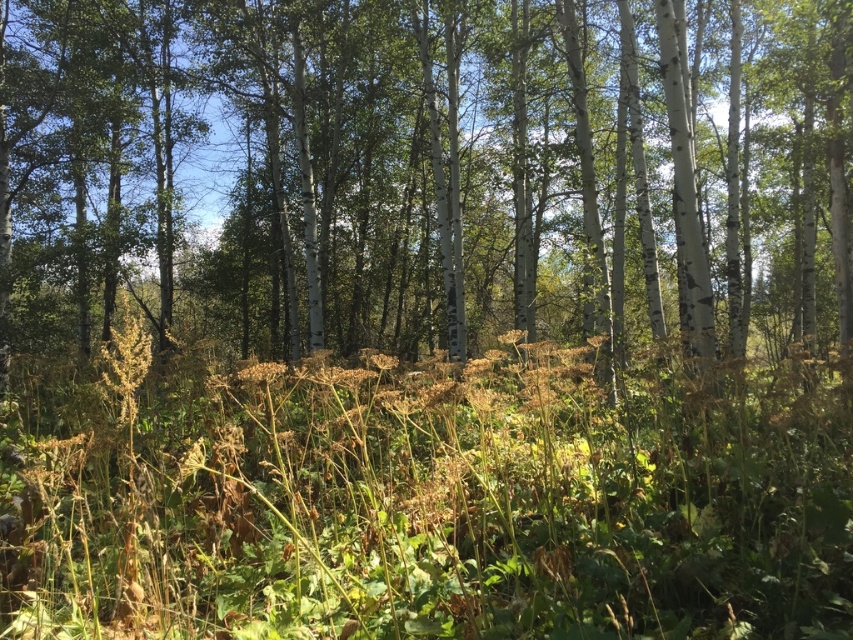
Question: In this image, where is white smooth tree at center located relative to brown dry grass at center?

Choices:
 (A) right
 (B) left

Answer: (A)

Question: Is the position of white smooth tree at center more distant than that of brown dry grass at center?

Choices:
 (A) no
 (B) yes

Answer: (B)

Question: From the image, what is the correct spatial relationship of white smooth tree at center in relation to brown dry grass at center?

Choices:
 (A) right
 (B) left

Answer: (A)

Question: Among these points, which one is nearest to the camera?

Choices:
 (A) (627, 284)
 (B) (662, 620)

Answer: (B)